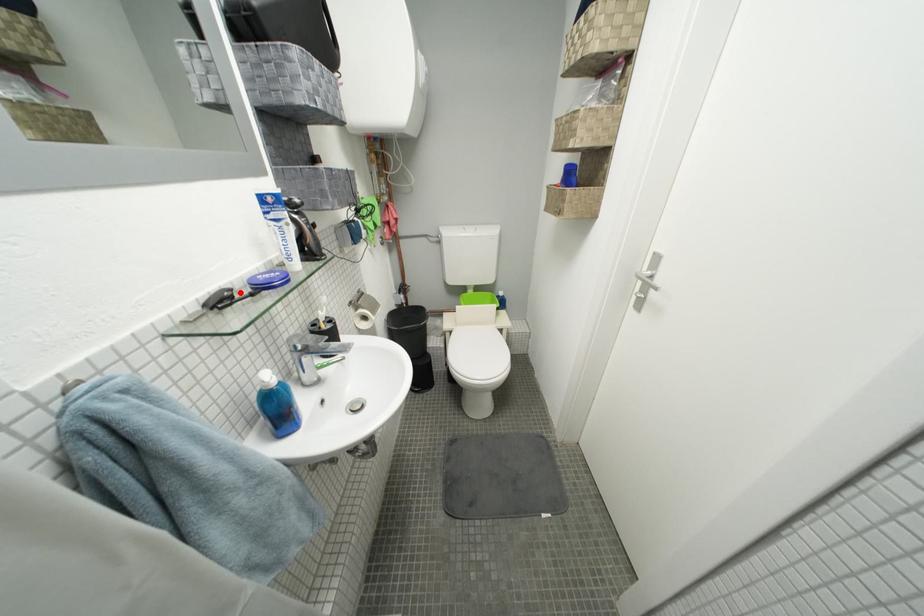
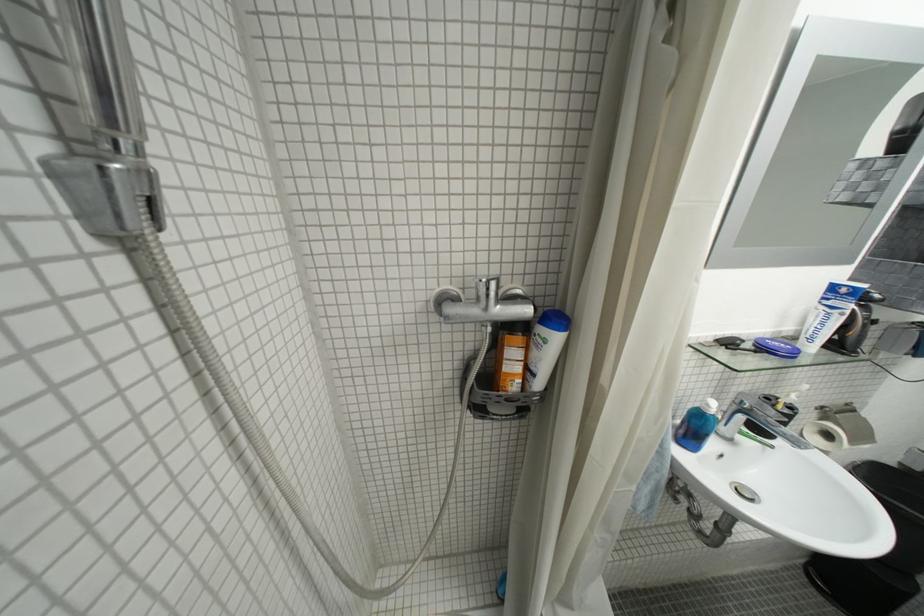
Find the pixel in the second image that matches the highlighted location in the first image.

(751, 342)